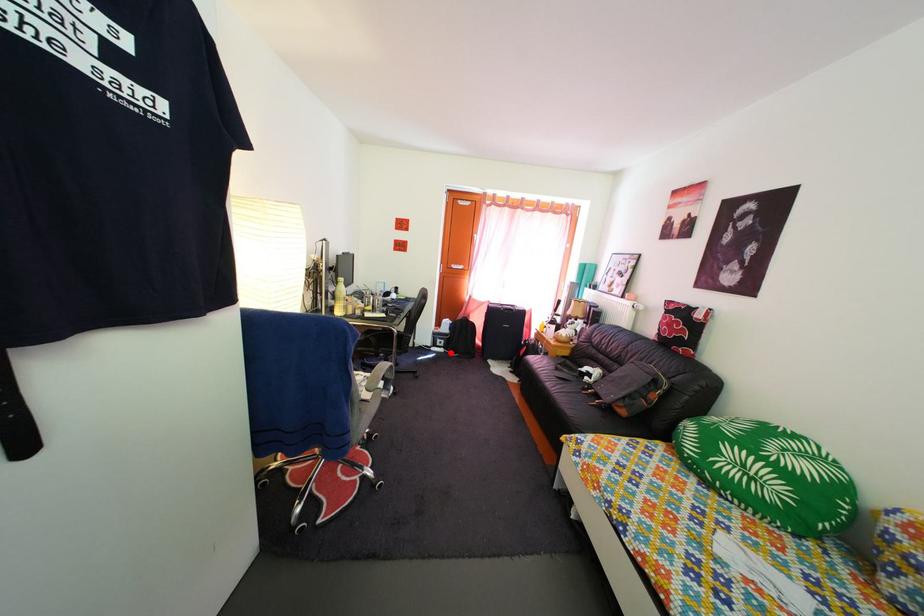
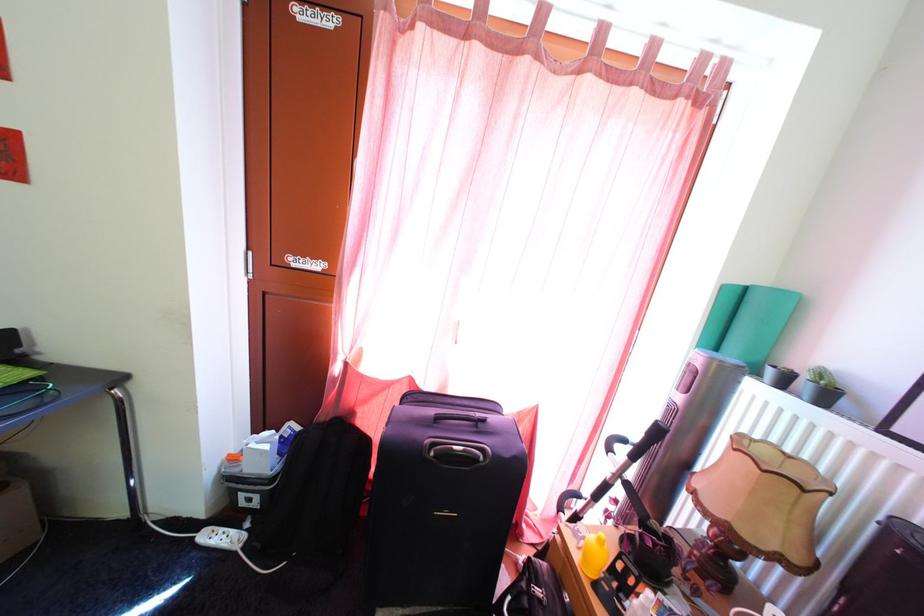
The point at the highlighted location is marked in the first image. Where is the corresponding point in the second image?

(264, 512)